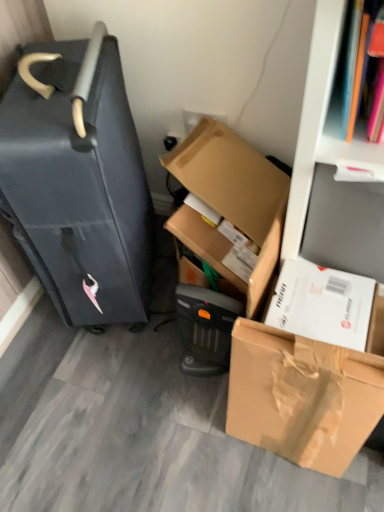
Question: In terms of width, does brown cardboard box at lower right, the second box positioned from the top, look wider or thinner when compared to matte black suitcase at left?

Choices:
 (A) wide
 (B) thin

Answer: (B)

Question: In the image, is brown cardboard box at lower right, the second box positioned from the top, on the left side or the right side of matte black suitcase at left?

Choices:
 (A) left
 (B) right

Answer: (B)

Question: Based on their relative distances, which object is nearer to the white cardboard bookshelf at upper right?

Choices:
 (A) cardboard box at center, which is the first box in top-to-bottom order
 (B) brown cardboard box at lower right, which is the first box in bottom-to-top order
 (C) matte black suitcase at left

Answer: (A)

Question: Estimate the real-world distances between objects in this image. Which object is closer to the brown cardboard box at lower right, the second box positioned from the top?

Choices:
 (A) matte black suitcase at left
 (B) cardboard box at center, which ranks as the 2th box in bottom-to-top order
 (C) white cardboard bookshelf at upper right

Answer: (C)